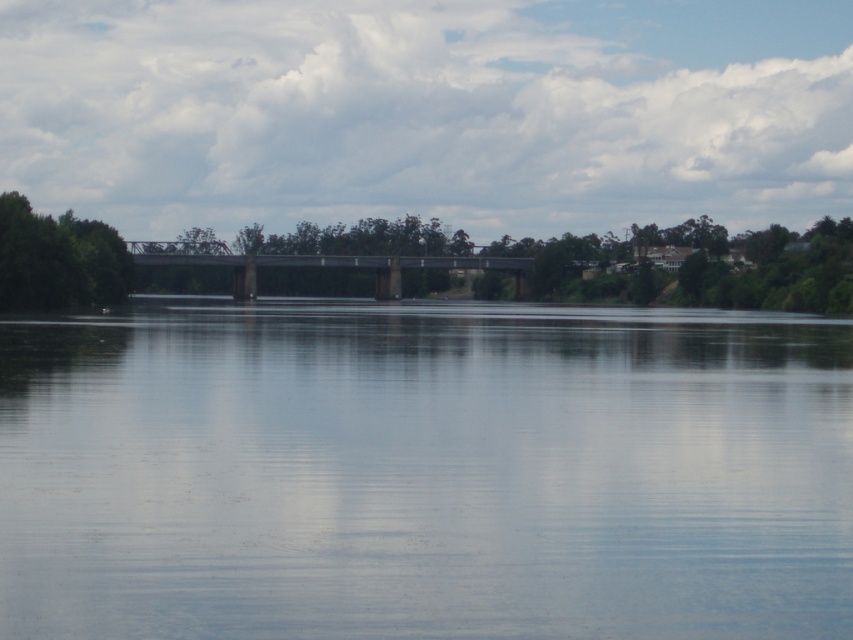
How far apart are transparent water at center and gray metallic bridge at center?

They are 389.92 feet apart.

This screenshot has height=640, width=853. What do you see at coordinates (425, 472) in the screenshot?
I see `transparent water at center` at bounding box center [425, 472].

Where is `transparent water at center`? transparent water at center is located at coordinates (425, 472).

Is transparent water at center wider than green leafy tree at left?

Yes.

Who is taller, transparent water at center or green leafy tree at left?

Standing taller between the two is green leafy tree at left.

Who is more forward, (444,582) or (51,218)?

Point (444,582) is more forward.

The height and width of the screenshot is (640, 853). What are the coordinates of `transparent water at center` in the screenshot? It's located at (425, 472).

Who is lower down, green leafy tree at left or gray metallic bridge at center?

green leafy tree at left is below.

Does green leafy tree at left have a lesser height compared to gray metallic bridge at center?

In fact, green leafy tree at left may be taller than gray metallic bridge at center.

Describe the element at coordinates (57, 259) in the screenshot. This screenshot has height=640, width=853. I see `green leafy tree at left` at that location.

Where is `green leafy tree at left`? Image resolution: width=853 pixels, height=640 pixels. green leafy tree at left is located at coordinates (57, 259).